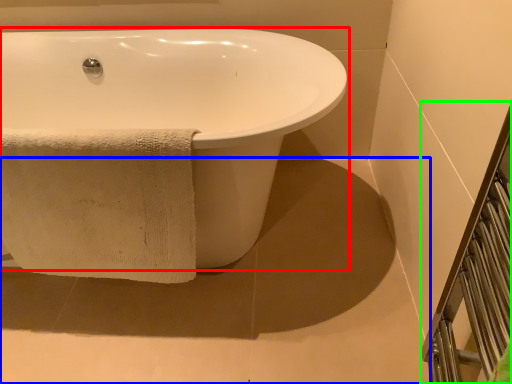
Question: Estimate the real-world distances between objects in this image. Which object is farther from bathtub (highlighted by a red box), concrete (highlighted by a blue box) or balustrade (highlighted by a green box)?

Choices:
 (A) concrete
 (B) balustrade

Answer: (B)